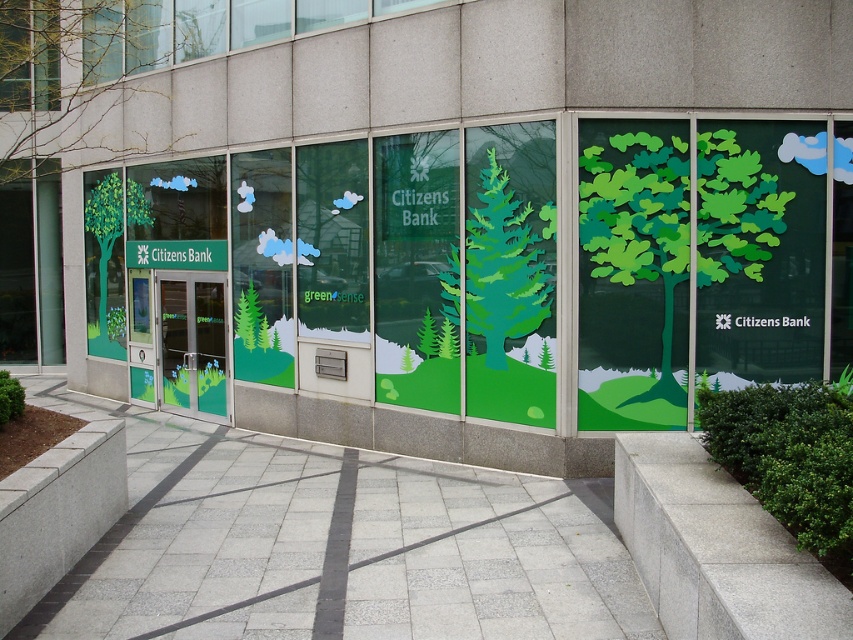
Which is more to the left, green paper tree at right or green matte tree at center?

From the viewer's perspective, green matte tree at center appears more on the left side.

The height and width of the screenshot is (640, 853). Identify the location of green paper tree at right. (660, 250).

This screenshot has width=853, height=640. What are the coordinates of `green paper tree at right` in the screenshot? It's located at (660, 250).

Based on the photo, is the position of green matte tree at center less distant than that of green glass doors at center?

Yes.

Can you confirm if green matte tree at center is shorter than green glass doors at center?

In fact, green matte tree at center may be taller than green glass doors at center.

Locate an element on the screen. The image size is (853, 640). green matte tree at center is located at coordinates (502, 268).

The image size is (853, 640). What are the coordinates of `green matte tree at center` in the screenshot? It's located at (502, 268).

Does point (514, 333) come in front of point (102, 324)?

Yes.

Between green matte tree at center and green matte tree at left, which one appears on the left side from the viewer's perspective?

green matte tree at left

This screenshot has height=640, width=853. What do you see at coordinates (502, 268) in the screenshot? I see `green matte tree at center` at bounding box center [502, 268].

Find the location of a particular element. This screenshot has height=640, width=853. green matte tree at center is located at coordinates (502, 268).